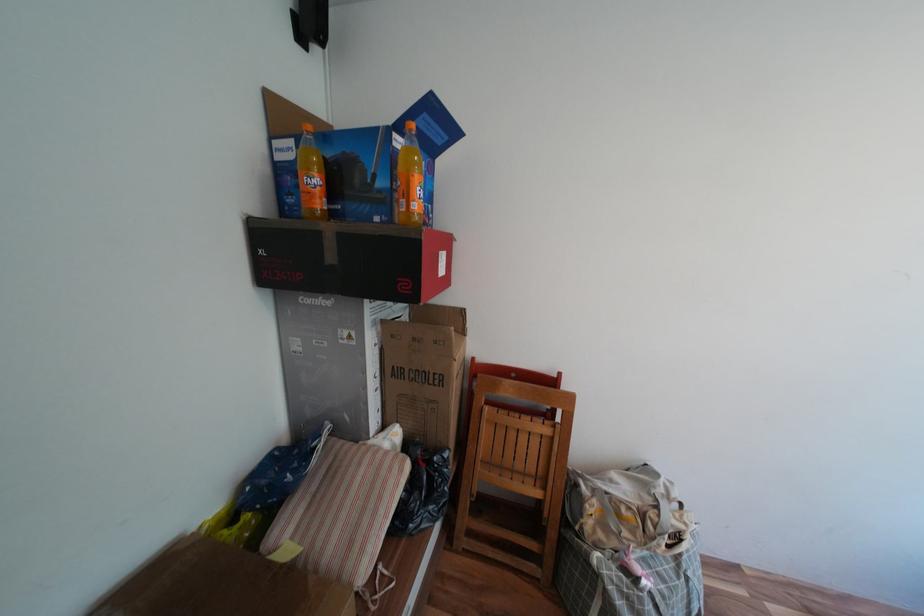
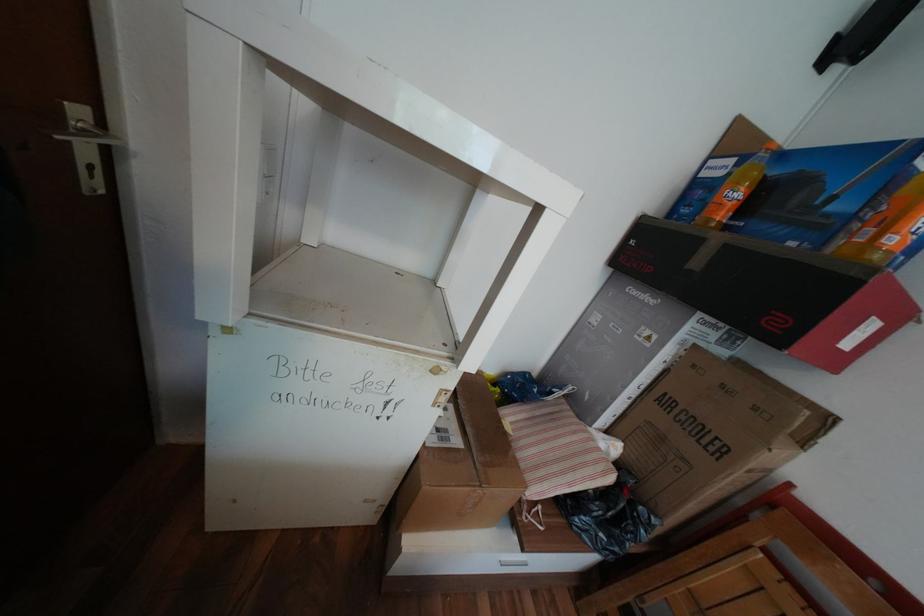
In the second image, find the point that corresponds to point (325, 180) in the first image.

(748, 195)